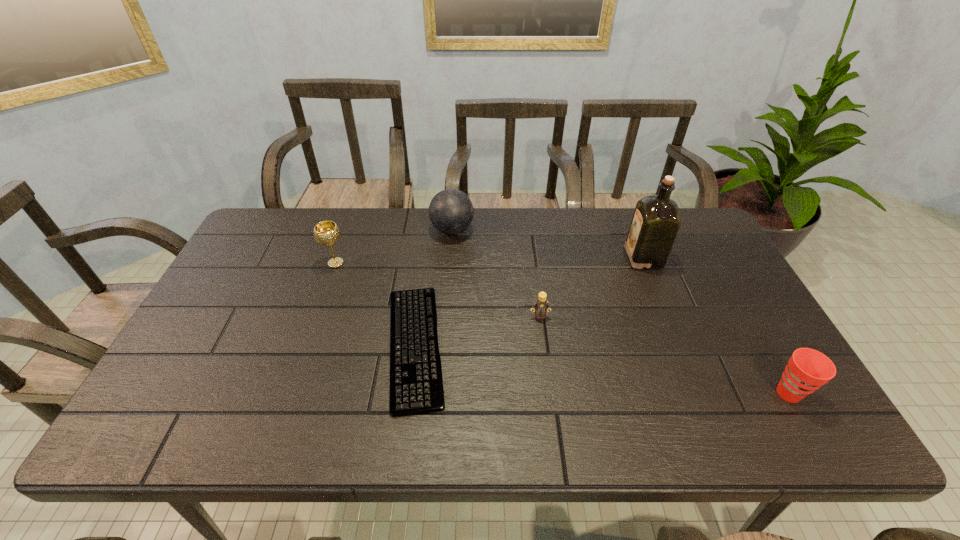
The height and width of the screenshot is (540, 960). I want to click on vacant point located between the cup and the farthest object, so click(x=620, y=312).

The image size is (960, 540). I want to click on empty space that is in between the tallest object and the shortest object, so click(x=529, y=302).

You are a GUI agent. You are given a task and a screenshot of the screen. Output one action in this format:
    pyautogui.click(x=<x>, y=<y>)
    Task: Click on the unoccupied position between the rightmost object and the farthest object
    
    Given the screenshot: What is the action you would take?
    pyautogui.click(x=620, y=312)

Identify the location of free area in between the farthest object and the rightmost object. The width and height of the screenshot is (960, 540). (620, 312).

Find the location of a particular element. Image resolution: width=960 pixels, height=540 pixels. free spot between the cup and the leftmost object is located at coordinates point(563,328).

This screenshot has width=960, height=540. What are the coordinates of `free space between the tallest object and the rightmost object` in the screenshot? It's located at (716, 326).

At what (x,y) coordinates should I click in order to perform the action: click on blank region between the cup and the fifth tallest object. Please return your answer as a coordinate pair (x, y). Looking at the image, I should click on (664, 355).

Where is `vacant space that is in between the rightmost object and the shortest object`? This screenshot has height=540, width=960. vacant space that is in between the rightmost object and the shortest object is located at coordinates (602, 369).

Locate an element on the screen. This screenshot has height=540, width=960. free point between the cup and the second shortest object is located at coordinates (664, 355).

You are a GUI agent. You are given a task and a screenshot of the screen. Output one action in this format:
    pyautogui.click(x=<x>, y=<y>)
    Task: Click on the object that can be found as the second closest to the fifth object from left to right
    This screenshot has height=540, width=960.
    Given the screenshot: What is the action you would take?
    pyautogui.click(x=807, y=370)